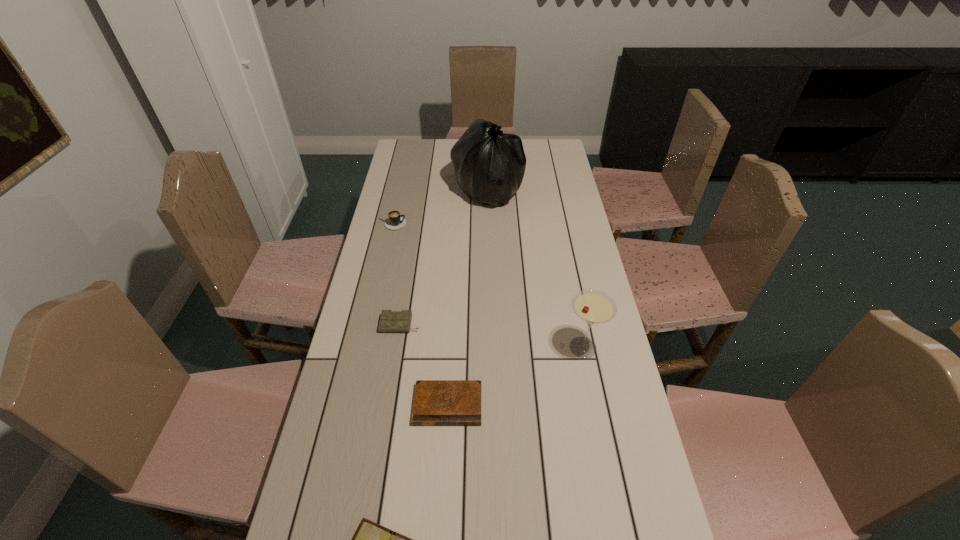
At what (x,y) coordinates should I click in order to perform the action: click on free space that satisfies the following two spatial constraints: 1. on the back side of the farthest diary; 2. with the handle on the side of the fourth shortest object. Please return your answer as a coordinate pair (x, y). Image resolution: width=960 pixels, height=540 pixels. Looking at the image, I should click on (417, 224).

Image resolution: width=960 pixels, height=540 pixels. I want to click on free space in the image that satisfies the following two spatial constraints: 1. with the handle on the side of the second farthest object; 2. on the right side of the tallest diary, so click(x=369, y=325).

This screenshot has width=960, height=540. Find the location of `free location that satisfies the following two spatial constraints: 1. with the handle on the side of the rightmost object; 2. on the left side of the fifth nearest object`. free location that satisfies the following two spatial constraints: 1. with the handle on the side of the rightmost object; 2. on the left side of the fifth nearest object is located at coordinates pos(364,348).

This screenshot has width=960, height=540. Find the location of `vacant area in the image that satisfies the following two spatial constraints: 1. with the handle on the side of the fourth shortest object; 2. on the right side of the farthest diary`. vacant area in the image that satisfies the following two spatial constraints: 1. with the handle on the side of the fourth shortest object; 2. on the right side of the farthest diary is located at coordinates (369, 325).

The image size is (960, 540). Identify the location of blank area in the image that satisfies the following two spatial constraints: 1. with the handle on the side of the fifth nearest object; 2. on the left side of the tallest diary. (369, 325).

You are a GUI agent. You are given a task and a screenshot of the screen. Output one action in this format:
    pyautogui.click(x=<x>, y=<y>)
    Task: Click on the vacant space that satisfies the following two spatial constraints: 1. with the handle on the side of the fourth shortest object; 2. on the back side of the martini
    The image size is (960, 540).
    Given the screenshot: What is the action you would take?
    pyautogui.click(x=364, y=348)